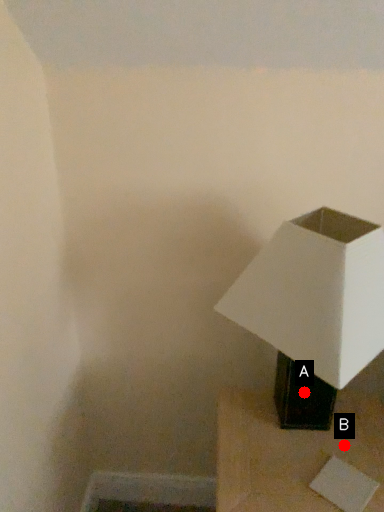
Question: Two points are circled on the image, labeled by A and B beside each circle. Which point appears closest to the camera in this image?

Choices:
 (A) A is closer
 (B) B is closer

Answer: (B)